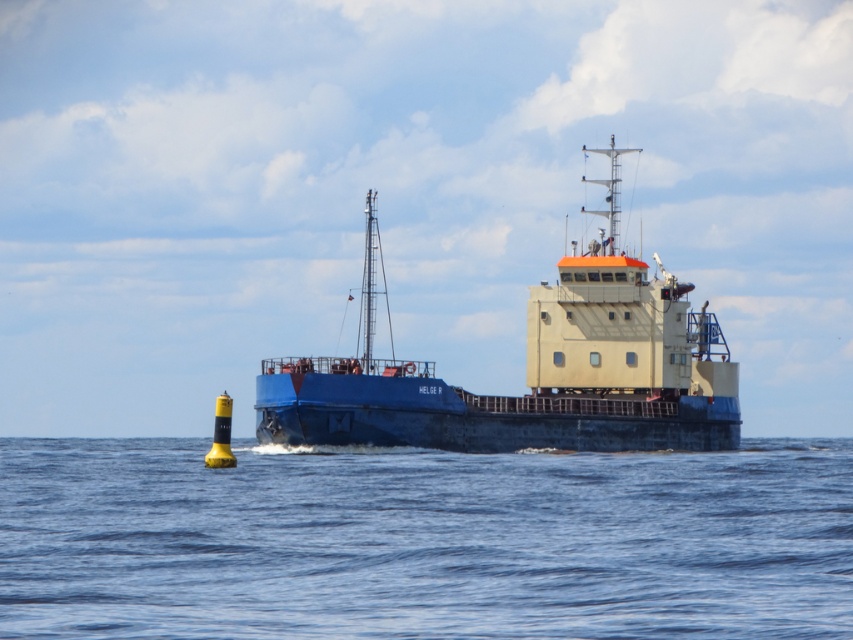
Question: Among these objects, which one is farthest from the camera?

Choices:
 (A) blue water at lower center
 (B) blue matte ship at center

Answer: (B)

Question: Does blue water at lower center have a smaller size compared to blue matte ship at center?

Choices:
 (A) no
 (B) yes

Answer: (B)

Question: Which object appears closest to the camera in this image?

Choices:
 (A) blue matte ship at center
 (B) blue water at lower center

Answer: (B)

Question: Observing the image, what is the correct spatial positioning of blue water at lower center in reference to blue matte ship at center?

Choices:
 (A) right
 (B) left

Answer: (A)

Question: In this image, where is blue water at lower center located relative to blue matte ship at center?

Choices:
 (A) left
 (B) right

Answer: (B)

Question: Which of the following is the farthest from the observer?

Choices:
 (A) (91, 545)
 (B) (606, 212)

Answer: (B)